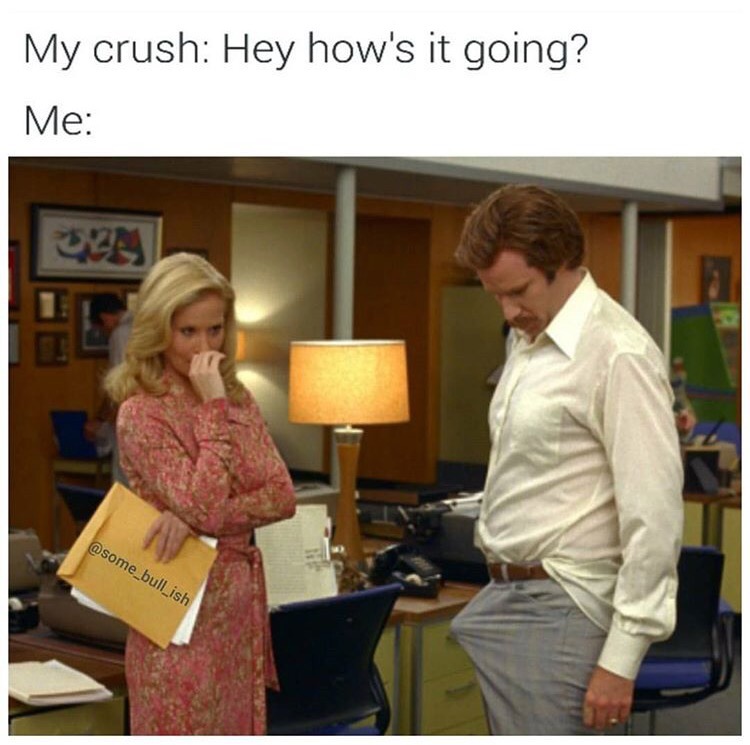
Locate an element on the screen. This screenshot has height=745, width=750. lime drawers is located at coordinates (434, 705).